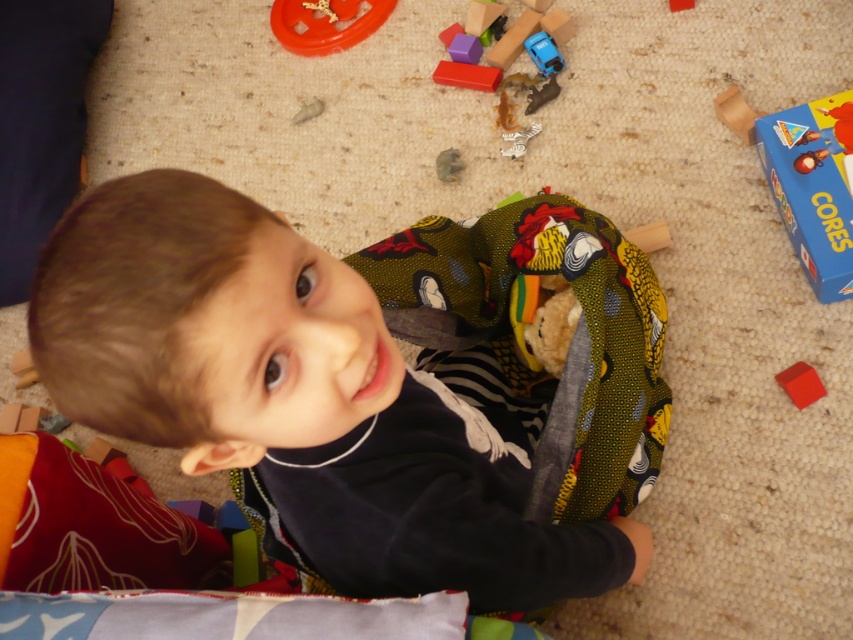
You are a parent trying to clean up the play area. You see the wooden blocks at upper center and the metallic blue car at center. Which object should you pick up first if you want to avoid disturbing the other?

You should pick up the wooden blocks at upper center first because it is positioned over the metallic blue car at center, so removing it first won

You are a toy organizer who needs to place a new toy between the wooden blocks at upper center and the metallic blue car at center. Which toy should you move closer to the camera to create space?

To create space between the wooden blocks at upper center and the metallic blue car at center, you should move the wooden blocks at upper center closer to the camera since it is already further to the viewer than the metallic blue car at center.